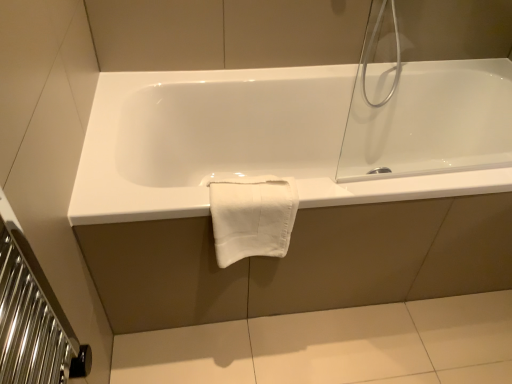
The image size is (512, 384). What do you see at coordinates (252, 216) in the screenshot?
I see `white cotton towel at center` at bounding box center [252, 216].

Where is `white cotton towel at center`? The width and height of the screenshot is (512, 384). white cotton towel at center is located at coordinates (252, 216).

Describe the element at coordinates (230, 143) in the screenshot. I see `white glossy bathtub at center` at that location.

Image resolution: width=512 pixels, height=384 pixels. In order to click on white glossy bathtub at center in this screenshot , I will do `click(230, 143)`.

You are a GUI agent. You are given a task and a screenshot of the screen. Output one action in this format:
    pyautogui.click(x=<x>, y=<y>)
    Task: Click on the white cotton towel at center
    
    Given the screenshot: What is the action you would take?
    pyautogui.click(x=252, y=216)

Which object is positioned more to the right, white cotton towel at center or white glossy bathtub at center?

white glossy bathtub at center is more to the right.

Who is more distant, white cotton towel at center or white glossy bathtub at center?

Positioned behind is white glossy bathtub at center.

Which point is more distant from viewer, (236, 201) or (278, 173)?

The point (278, 173) is behind.

From the image's perspective, which is above, white cotton towel at center or white glossy bathtub at center?

white glossy bathtub at center, from the image's perspective.

From a real-world perspective, between white cotton towel at center and white glossy bathtub at center, who is vertically lower?

white glossy bathtub at center, from a real-world perspective.

Does white cotton towel at center have a lesser width compared to white glossy bathtub at center?

Yes, white cotton towel at center is thinner than white glossy bathtub at center.

Who is shorter, white cotton towel at center or white glossy bathtub at center?

white cotton towel at center.

Between white cotton towel at center and white glossy bathtub at center, which one has larger size?

white glossy bathtub at center.

Looking at this image, is white cotton towel at center inside or outside of white glossy bathtub at center?

white cotton towel at center lies within the bounds of white glossy bathtub at center.

Is white cotton towel at center directly adjacent to white glossy bathtub at center?

No, white cotton towel at center is not with white glossy bathtub at center.

Is white cotton towel at center oriented towards white glossy bathtub at center?

Yes, white cotton towel at center is oriented towards white glossy bathtub at center.

How distant is white cotton towel at center from white glossy bathtub at center?

white cotton towel at center is 31.17 centimeters away from white glossy bathtub at center.

Image resolution: width=512 pixels, height=384 pixels. In order to click on bathtub behind the white cotton towel at center in this screenshot , I will do `click(230, 143)`.

Is white glossy bathtub at center at the left side of white cotton towel at center?

No.

Is white glossy bathtub at center positioned in front of white cotton towel at center?

No.

Considering the points (310, 178) and (282, 234), which point is in front, point (310, 178) or point (282, 234)?

The point (282, 234) is in front.

From the image's perspective, is white glossy bathtub at center located beneath white cotton towel at center?

No, from the image's perspective, white glossy bathtub at center is not beneath white cotton towel at center.

From a real-world perspective, is white glossy bathtub at center physically located above or below white cotton towel at center?

From a real-world perspective, white glossy bathtub at center is physically below white cotton towel at center.

Which of these two, white glossy bathtub at center or white cotton towel at center, is thinner?

white cotton towel at center.

Is white glossy bathtub at center shorter than white cotton towel at center?

No.

Which of these two, white glossy bathtub at center or white cotton towel at center, is smaller?

With smaller size is white cotton towel at center.

Based on the photo, is white glossy bathtub at center completely or partially outside of white cotton towel at center?

Yes, white glossy bathtub at center is not within white cotton towel at center.

Would you consider white glossy bathtub at center to be distant from white cotton towel at center?

That's not correct — white glossy bathtub at center is a little close to white cotton towel at center.

Is white glossy bathtub at center oriented away from white cotton towel at center?

Yes, white glossy bathtub at center's orientation is away from white cotton towel at center.

How distant is white glossy bathtub at center from white cotton towel at center?

white glossy bathtub at center is 12.27 inches from white cotton towel at center.

This screenshot has height=384, width=512. I want to click on bath towel on the left of white glossy bathtub at center, so click(252, 216).

Identify the location of bathtub above the white cotton towel at center (from the image's perspective). This screenshot has width=512, height=384. (230, 143).

Where is `bath towel on the left of white glossy bathtub at center`? The height and width of the screenshot is (384, 512). bath towel on the left of white glossy bathtub at center is located at coordinates (252, 216).